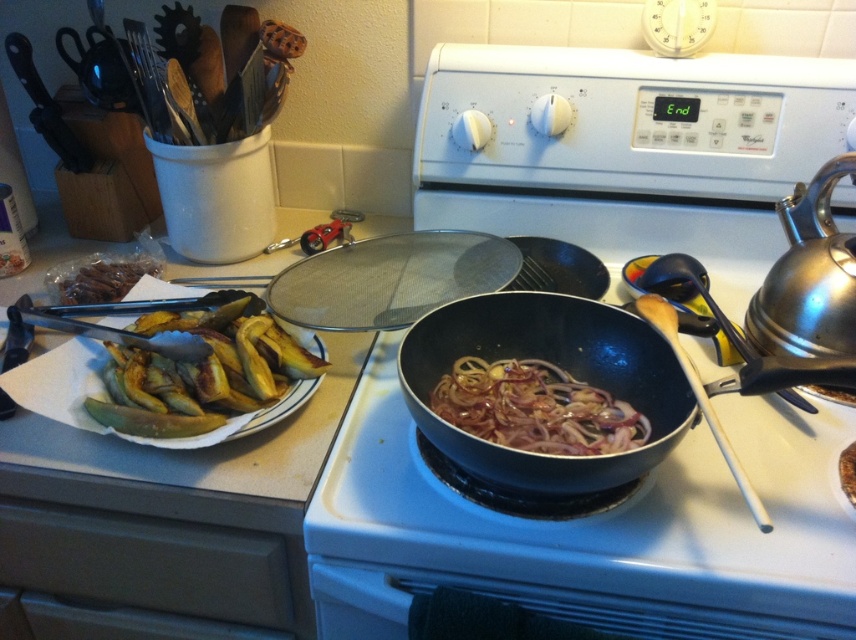
Question: Does golden crispy plantains at left have a lesser width compared to white glossy oven at center?

Choices:
 (A) yes
 (B) no

Answer: (A)

Question: Among these points, which one is nearest to the camera?

Choices:
 (A) (823, 173)
 (B) (550, 616)
 (C) (571, 438)

Answer: (B)

Question: Can you confirm if white glossy oven at center is wider than shiny metallic kettle at right?

Choices:
 (A) yes
 (B) no

Answer: (A)

Question: Which object is the closest to the slightly translucent dark brown onions at center?

Choices:
 (A) white glossy oven at center
 (B) brown matte dried beans at left
 (C) golden crispy plantains at left

Answer: (A)

Question: Which point is closer to the camera?

Choices:
 (A) white glossy oven at center
 (B) metallic mesh strainer at upper center
 (C) shiny metallic kettle at right

Answer: (A)

Question: Does metallic mesh strainer at upper center appear on the right side of white glossy oven at center?

Choices:
 (A) yes
 (B) no

Answer: (B)